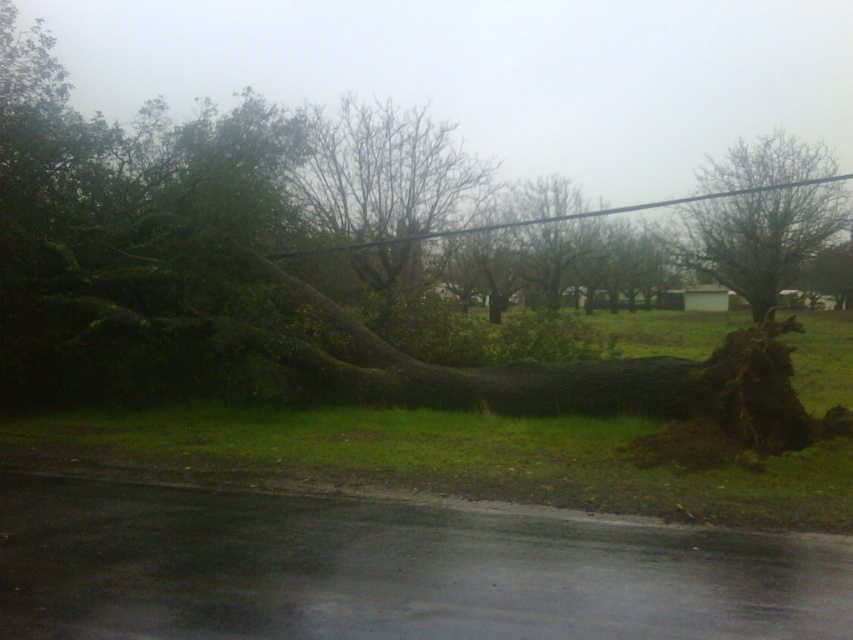
You are a delivery driver who needs to navigate around the fallen tree blocking the road. You see the bare wood tree at center and the black wire at upper center. Which object is closer to the left side of the road?

The black wire at upper center is closer to the left side of the road because the bare wood tree at center is positioned on the right side of it.

You are a delivery driver trying to navigate through the fallen tree blocking the road. You see the bare branches at center and the bare wood tree at center. Which object is higher from the ground?

The bare branches at center are taller than the bare wood tree at center, so the bare branches at center are higher from the ground.